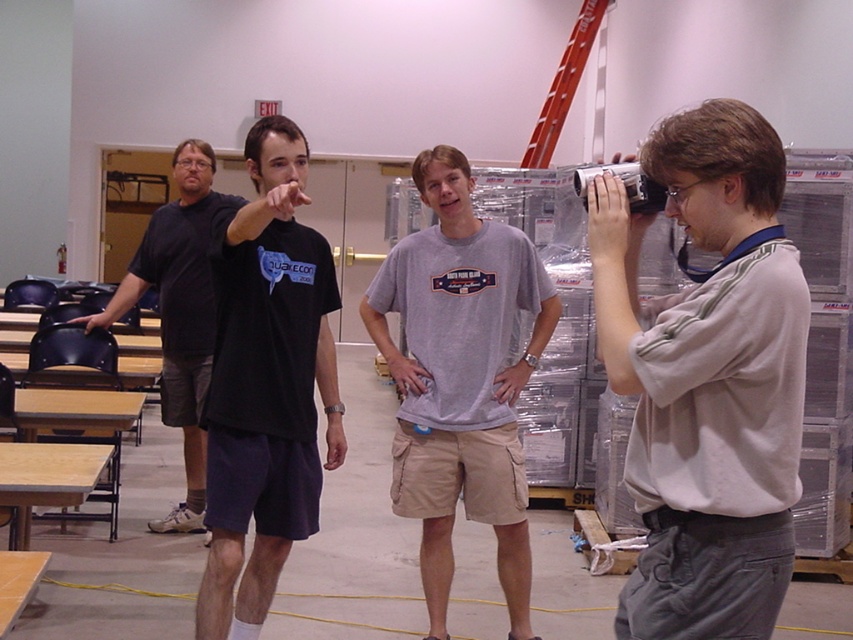
Question: Which point is farther to the camera?

Choices:
 (A) black cotton t-shirt at left
 (B) metallic silver ladder at upper right
 (C) black cotton t-shirt at center

Answer: (B)

Question: Does gray cotton t-shirt at center have a larger size compared to metallic silver ladder at upper right?

Choices:
 (A) no
 (B) yes

Answer: (A)

Question: Which is farther from the gray cotton t-shirt at center?

Choices:
 (A) black cotton t-shirt at center
 (B) metallic silver ladder at upper right
 (C) light gray shirt at right

Answer: (B)

Question: Is light gray shirt at right smaller than black cotton t-shirt at center?

Choices:
 (A) no
 (B) yes

Answer: (B)

Question: Which object is farther from the camera taking this photo?

Choices:
 (A) gray cotton t-shirt at center
 (B) light gray shirt at right
 (C) black cotton t-shirt at center
 (D) metallic silver ladder at upper right

Answer: (D)

Question: Is black cotton t-shirt at left in front of metallic silver ladder at upper right?

Choices:
 (A) yes
 (B) no

Answer: (A)